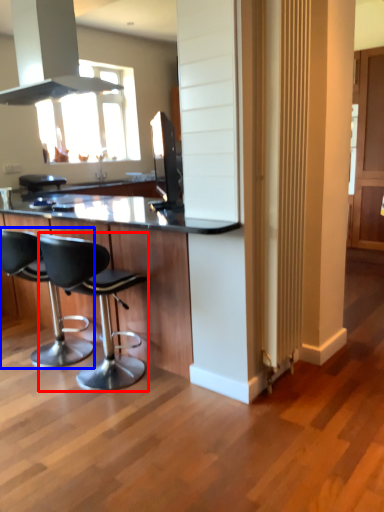
Question: Among these objects, which one is nearest to the camera, chair (highlighted by a red box) or chair (highlighted by a blue box)?

Choices:
 (A) chair
 (B) chair

Answer: (A)